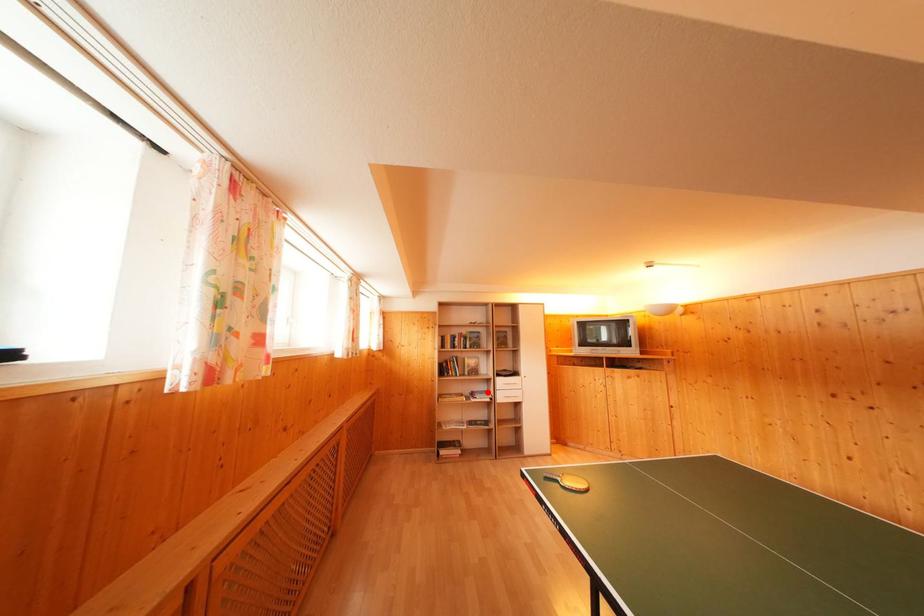
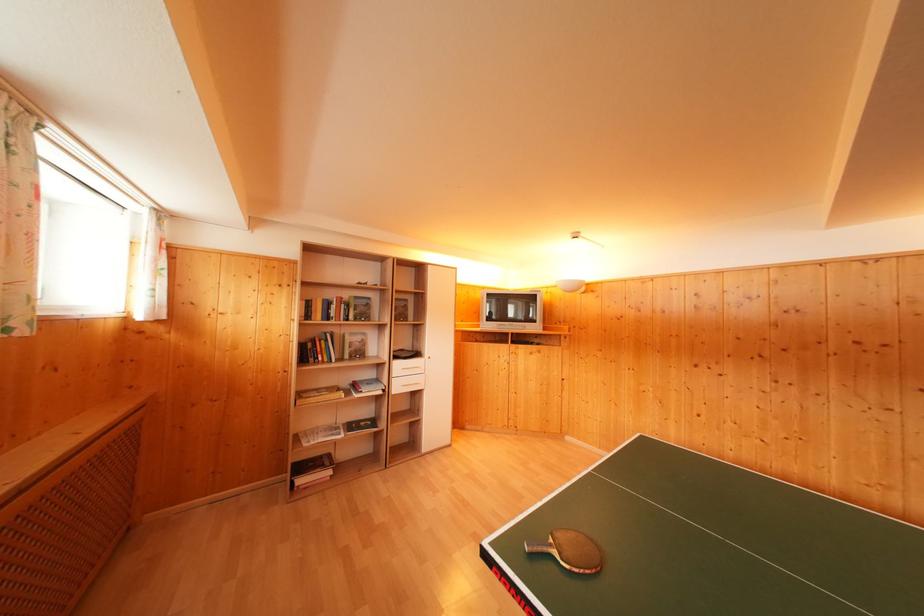
Question: I am providing you with two images of the same scene from different viewpoints. Image1 has a red point marked. In image2, the corresponding 3D location appears at what relative position? Reply with the corresponding letter.

Choices:
 (A) Closer
 (B) Farther

Answer: (A)